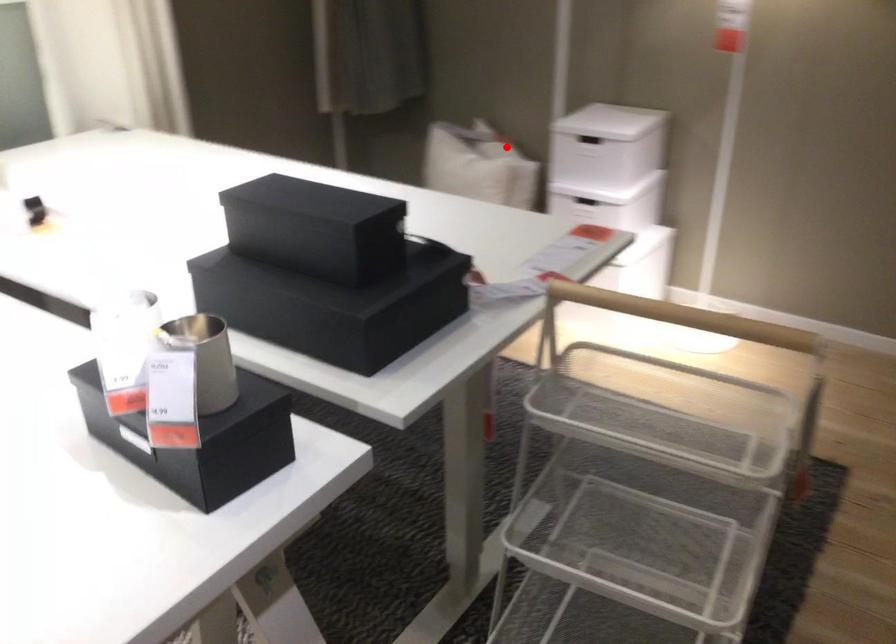
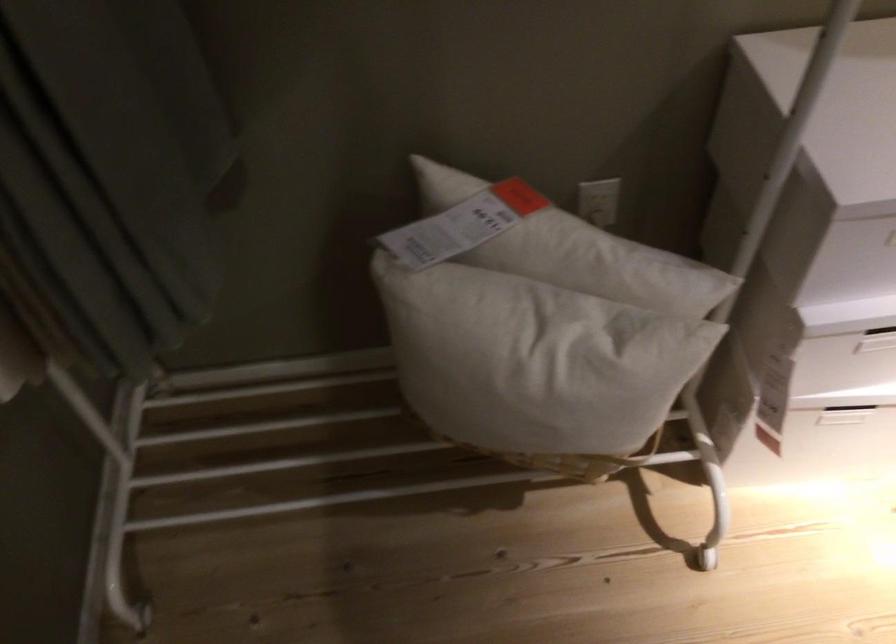
In the second image, find the point that corresponds to the highlighted location in the first image.

(572, 249)